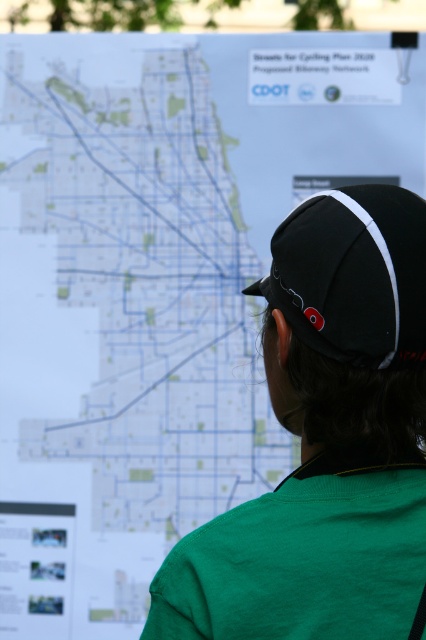
Question: Which point is farther from the camera taking this photo?

Choices:
 (A) (347, 416)
 (B) (374, 296)

Answer: (A)

Question: Is green fabric shirt at center to the left of black fabric baseball cap at center from the viewer's perspective?

Choices:
 (A) no
 (B) yes

Answer: (B)

Question: Is green fabric shirt at center smaller than black fabric baseball cap at center?

Choices:
 (A) no
 (B) yes

Answer: (A)

Question: Which point is closer to the camera?

Choices:
 (A) black fabric baseball cap at center
 (B) green fabric shirt at center

Answer: (B)

Question: Can you confirm if green fabric shirt at center is bigger than black fabric baseball cap at center?

Choices:
 (A) no
 (B) yes

Answer: (B)